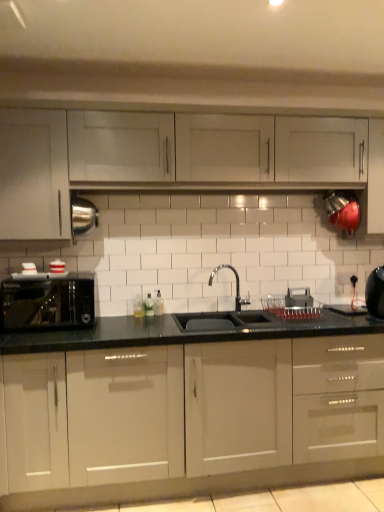
Question: Considering the relative sizes of white plastic electric outlet at center and glossy white cabinets at center, the 3th cabinetry from the top, in the image provided, is white plastic electric outlet at center bigger than glossy white cabinets at center, the 3th cabinetry from the top,?

Choices:
 (A) yes
 (B) no

Answer: (B)

Question: From the image's perspective, is white plastic electric outlet at center beneath glossy white cabinets at center, the 3th cabinetry from the top?

Choices:
 (A) no
 (B) yes

Answer: (A)

Question: From a real-world perspective, is white plastic electric outlet at center physically below glossy white cabinets at center, the first cabinetry in the bottom-to-top sequence?

Choices:
 (A) yes
 (B) no

Answer: (B)

Question: From a real-world perspective, is white plastic electric outlet at center on glossy white cabinets at center, the first cabinetry in the bottom-to-top sequence?

Choices:
 (A) no
 (B) yes

Answer: (B)

Question: Is white plastic electric outlet at center turned away from glossy white cabinets at center, the 3th cabinetry from the top?

Choices:
 (A) no
 (B) yes

Answer: (A)

Question: Based on their positions, is white glossy cabinet at upper left, the 2th cabinetry from the top, located to the left or right of white plastic electric outlet at center?

Choices:
 (A) right
 (B) left

Answer: (B)

Question: From the image's perspective, is white glossy cabinet at upper left, the 2th cabinetry from the top, located above or below white plastic electric outlet at center?

Choices:
 (A) below
 (B) above

Answer: (B)

Question: Is point (13, 228) closer or farther from the camera than point (336, 276)?

Choices:
 (A) closer
 (B) farther

Answer: (A)

Question: Based on their sizes in the image, would you say white glossy cabinet at upper left, which appears as the second cabinetry when ordered from the bottom, is bigger or smaller than white plastic electric outlet at center?

Choices:
 (A) big
 (B) small

Answer: (A)

Question: Is white glossy cabinets at upper center, placed as the first cabinetry when sorted from top to bottom, in front of or behind white plastic electric outlet at center in the image?

Choices:
 (A) behind
 (B) front

Answer: (B)

Question: Which is correct: white glossy cabinets at upper center, placed as the first cabinetry when sorted from top to bottom, is inside white plastic electric outlet at center, or outside of it?

Choices:
 (A) inside
 (B) outside

Answer: (B)

Question: From the image's perspective, relative to white plastic electric outlet at center, is white glossy cabinets at upper center, the 3th cabinetry in the bottom-to-top sequence, above or below?

Choices:
 (A) above
 (B) below

Answer: (A)

Question: Is white glossy cabinets at upper center, the 3th cabinetry in the bottom-to-top sequence, wider or thinner than white plastic electric outlet at center?

Choices:
 (A) wide
 (B) thin

Answer: (A)

Question: From a real-world perspective, relative to white glossy cabinet at upper left, the 2th cabinetry from the top, is glossy white cabinets at center, the 3th cabinetry from the top, vertically above or below?

Choices:
 (A) below
 (B) above

Answer: (A)

Question: Considering the positions of glossy white cabinets at center, the 3th cabinetry from the top, and white glossy cabinet at upper left, which appears as the second cabinetry when ordered from the bottom, in the image, is glossy white cabinets at center, the 3th cabinetry from the top, taller or shorter than white glossy cabinet at upper left, which appears as the second cabinetry when ordered from the bottom,?

Choices:
 (A) short
 (B) tall

Answer: (B)